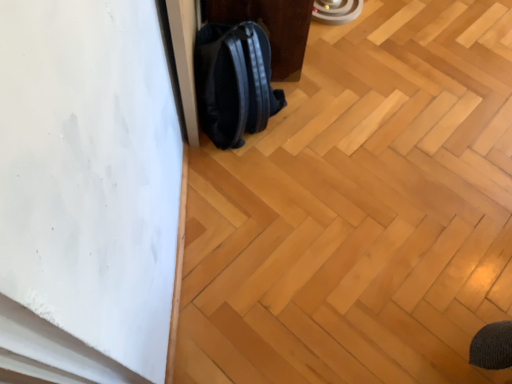
Locate an element on the screen. free space in front of black matte backpack at center is located at coordinates (253, 192).